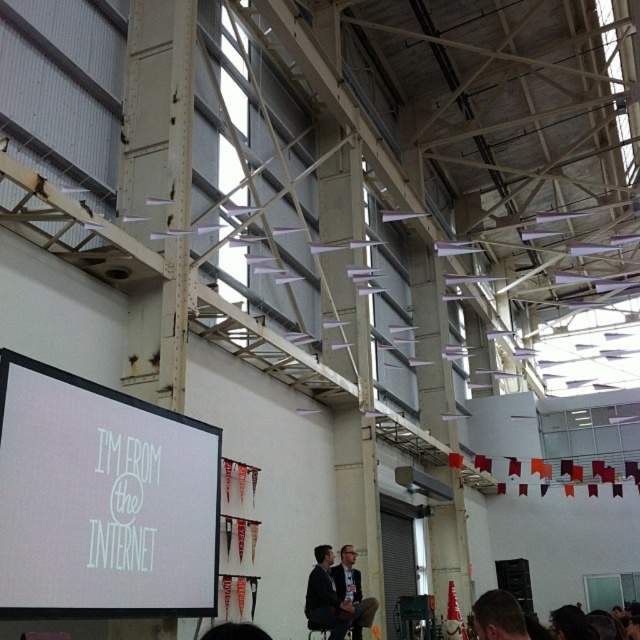
You are an event organizer setting up a presentation in this space. You need to ensure that the white matte projection screen at upper left is visible to all attendees seated in the room. Considering the dark gray suit at center, which is where the speaker will stand, will the screen be tall enough to be seen over the speaker?

The white matte projection screen at upper left is much taller than the dark gray suit at center, so yes, the screen will be tall enough to be seen over the speaker standing at the dark gray suit at center.

Consider the image. You are standing in the large hall and want to reach a specific point marked as point (20, 456). If you are currently 20 feet away from that point, how much closer do you need to get to be exactly at the point?

The distance of point (20, 456) from viewer is 15.42 feet. Since you are currently 20 feet away, you need to move 20 minus 15.42 equals 4.58 feet closer to reach the point.

You are organizing a formal event and need to choose between two dark gray suits displayed in the image. The suits are labeled as dark gray suit at center and dark gray suit at lower center. Based on their widths, which one would you recommend for a more formal occasion?

The dark gray suit at center is thinner than the dark gray suit at lower center. For a more formal occasion, the thinner dark gray suit at center is recommended as it typically offers a more tailored and elegant appearance.